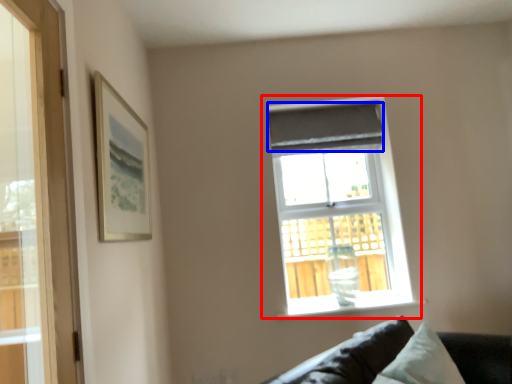
Question: Which object appears farthest to the camera in this image, window (highlighted by a red box) or curtain (highlighted by a blue box)?

Choices:
 (A) window
 (B) curtain

Answer: (B)